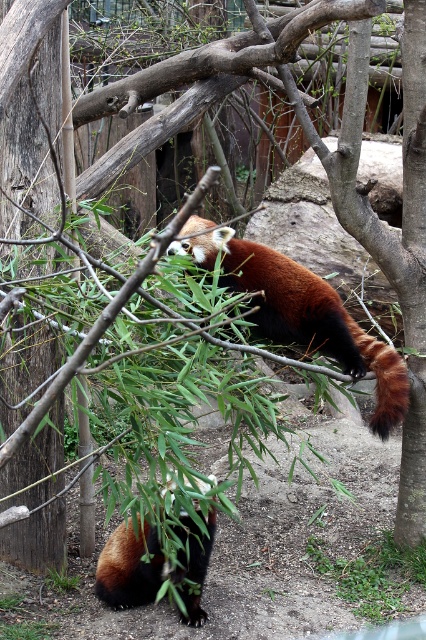
Question: Can you confirm if fluffy reddish-brown red panda at center is positioned to the right of fluffy reddish-brown panda at lower center?

Choices:
 (A) no
 (B) yes

Answer: (B)

Question: Does fluffy reddish-brown red panda at center lie in front of fluffy reddish-brown panda at lower center?

Choices:
 (A) no
 (B) yes

Answer: (B)

Question: Is fluffy reddish-brown red panda at center positioned before fluffy reddish-brown panda at lower center?

Choices:
 (A) no
 (B) yes

Answer: (B)

Question: Which of the following is the farthest from the observer?

Choices:
 (A) fluffy reddish-brown red panda at center
 (B) fluffy reddish-brown panda at lower center

Answer: (B)

Question: Which point is closer to the camera?

Choices:
 (A) fluffy reddish-brown red panda at center
 (B) fluffy reddish-brown panda at lower center

Answer: (A)